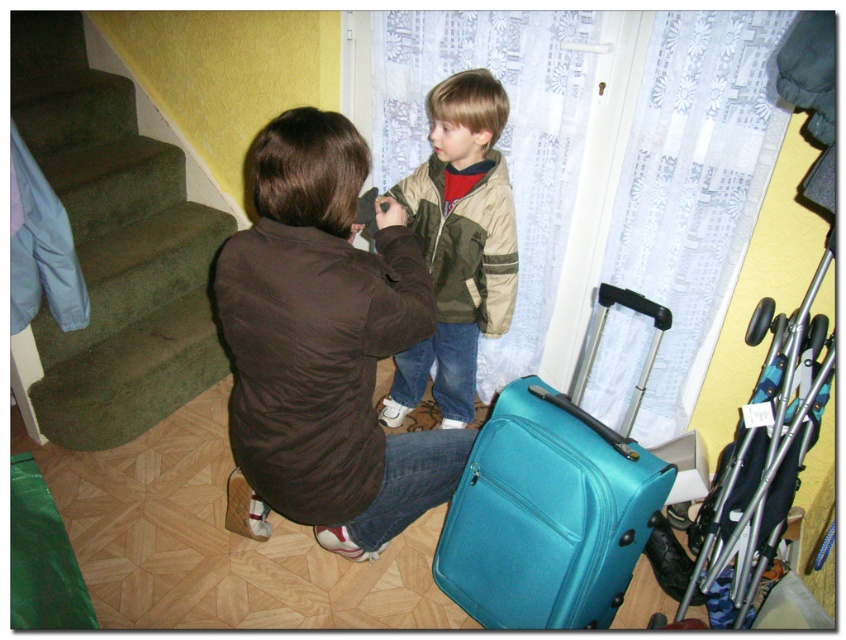
You are standing in the hallway and want to reach the blue jacket on the staircase. There are two points marked in the scene. Which point is closer to you, point (40,388) or point (635,301)?

Point (40,388) is closer to you because it is further to the viewer than point (635,301).

You are a delivery person who needs to place a small package on the green carpeted stairs at left. However, there is a brown fabric jacket at center in the way. Can you move the jacket to the side to access the stairs?

The brown fabric jacket at center is below the green carpeted stairs at left, so you can move it aside to access the stairs.